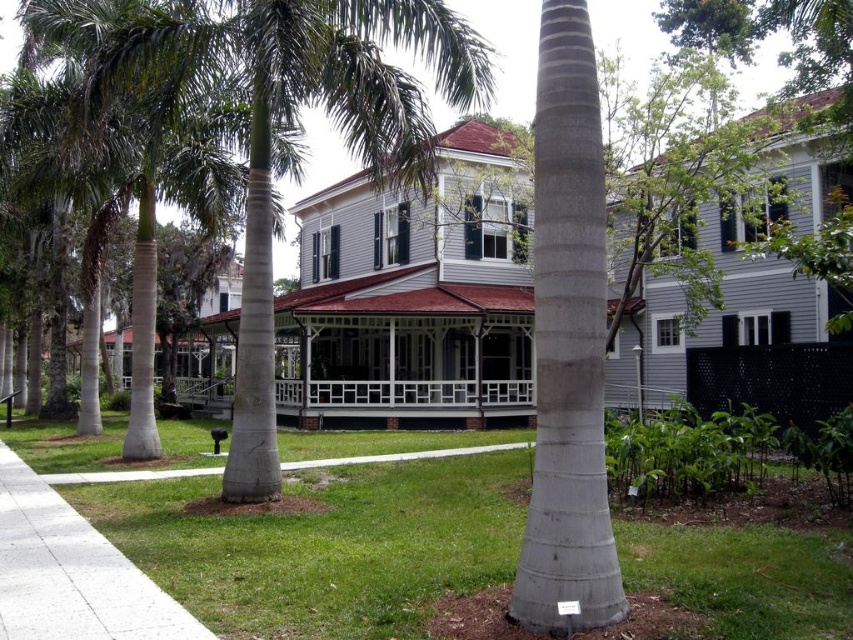
You are a painter standing on the ground at the center of the scene. You want to paint both the gray textured palm tree trunk at center and the concrete at center. Which object will require you to look upward more while painting?

The gray textured palm tree trunk at center is much taller than the concrete at center, so you will need to look upward more when painting the gray textured palm tree trunk at center.

You are a delivery person trying to deliver a package to the house. The package can only be placed on the ground between the green leafy palm tree at center and the gray textured palm tree trunk at center. Is there enough space to place the package between them?

The green leafy palm tree at center and the gray textured palm tree trunk at center are 5.93 meters apart, so there is sufficient space to place the package between them.